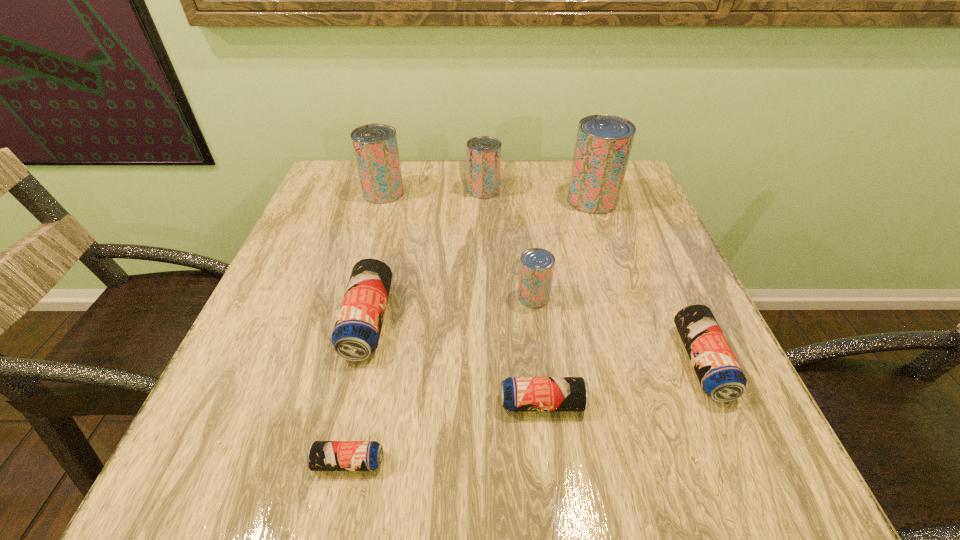
This screenshot has height=540, width=960. Identify the location of vacant area at the left edge of the desktop. (329, 232).

I want to click on vacant position at the right edge of the desktop, so click(633, 354).

The width and height of the screenshot is (960, 540). I want to click on vacant space at the far left corner of the desktop, so click(x=337, y=168).

This screenshot has height=540, width=960. What are the coordinates of `vacant space at the near left corner` in the screenshot? It's located at (186, 470).

Image resolution: width=960 pixels, height=540 pixels. Find the location of `free space at the far right corner`. free space at the far right corner is located at coordinates (625, 186).

In the image, there is a desktop. At what (x,y) coordinates should I click in order to perform the action: click on vacant space at the near right corner. Please return your answer as a coordinate pair (x, y). This screenshot has width=960, height=540. Looking at the image, I should click on (707, 443).

The width and height of the screenshot is (960, 540). Identify the location of vacant space that is in between the sixth tallest beer can and the fourth shortest object. (535, 342).

Where is `vacant space that is in between the second red beer can from right to left and the fifth tallest beer can`? The height and width of the screenshot is (540, 960). vacant space that is in between the second red beer can from right to left and the fifth tallest beer can is located at coordinates (450, 309).

The image size is (960, 540). In order to click on free space between the sixth tallest object and the tallest object in this screenshot , I will do `click(647, 281)`.

Where is `free space between the second blue beer can from right to left and the sixth shortest object`? Image resolution: width=960 pixels, height=540 pixels. free space between the second blue beer can from right to left and the sixth shortest object is located at coordinates (513, 296).